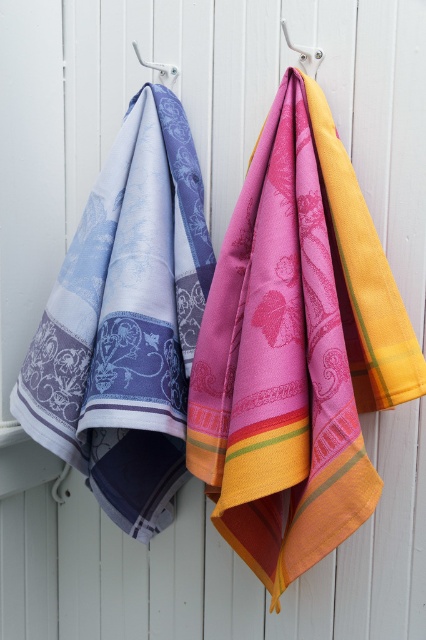
Question: In this image, where is pink woven towel at center located relative to matte blue and purple fabric at left?

Choices:
 (A) above
 (B) below

Answer: (B)

Question: Which of these objects is positioned farthest from the matte blue and purple fabric at left?

Choices:
 (A) white plastic hook at upper right
 (B) pink woven towel at center

Answer: (A)

Question: Which is nearer to the pink woven towel at center?

Choices:
 (A) white plastic hook at upper right
 (B) matte blue and purple fabric at left

Answer: (B)

Question: Is the position of pink woven towel at center less distant than that of matte blue and purple fabric at left?

Choices:
 (A) yes
 (B) no

Answer: (A)

Question: Which object is positioned closest to the white plastic hook at upper right?

Choices:
 (A) pink woven towel at center
 (B) matte blue and purple fabric at left

Answer: (A)

Question: Is matte blue and purple fabric at left thinner than white plastic hook at upper right?

Choices:
 (A) no
 (B) yes

Answer: (A)